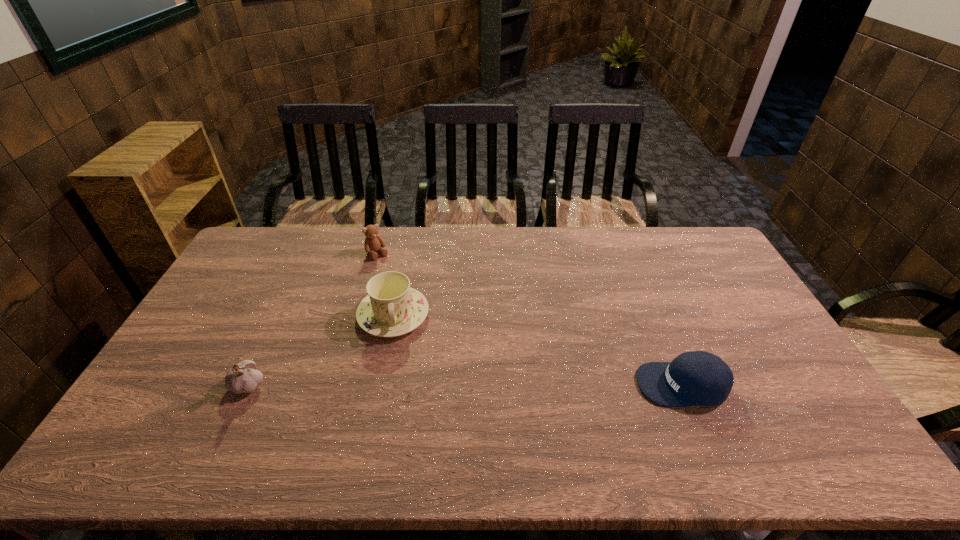
Identify the location of vacant region located 0.350m on the front-facing side of the teddy bear. The image size is (960, 540). (426, 319).

Image resolution: width=960 pixels, height=540 pixels. I want to click on free spot located on the front-facing side of the teddy bear, so click(x=407, y=294).

Locate an element on the screen. vacant space located 0.170m on the handle side of the chinaware is located at coordinates (401, 389).

At what (x,y) coordinates should I click in order to perform the action: click on free space located on the handle side of the chinaware. Please return your answer as a coordinate pair (x, y). This screenshot has height=540, width=960. Looking at the image, I should click on (402, 404).

The width and height of the screenshot is (960, 540). Find the location of `blank space located 0.260m on the handle side of the chinaware`. blank space located 0.260m on the handle side of the chinaware is located at coordinates (404, 418).

The width and height of the screenshot is (960, 540). I want to click on object at the far edge, so click(373, 242).

The height and width of the screenshot is (540, 960). I want to click on garlic that is at the near edge, so click(x=243, y=377).

Where is `baseball cap that is at the near edge`? baseball cap that is at the near edge is located at coordinates (693, 378).

Identify the location of free space at the far edge of the desktop. The height and width of the screenshot is (540, 960). (611, 240).

The height and width of the screenshot is (540, 960). In the image, there is a desktop. Find the location of `vacant space at the near edge`. vacant space at the near edge is located at coordinates (197, 422).